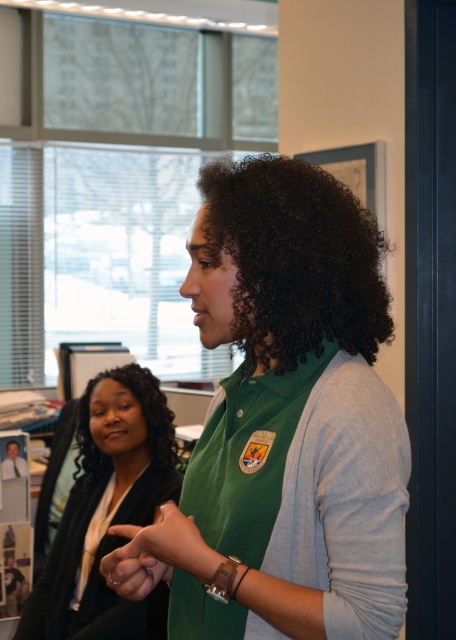
Which is in front, point (123, 387) or point (151, 420)?

Point (151, 420) is in front.

Consider the image. Does matte black jacket at left have a larger size compared to black curly hair at lower left?

Yes, matte black jacket at left is bigger than black curly hair at lower left.

Is point (41, 605) farther from camera compared to point (176, 451)?

No, it is not.

This screenshot has height=640, width=456. I want to click on matte black jacket at left, so click(108, 513).

Consider the image. Can you confirm if green matte vest at center is positioned to the left of smooth skin hand at center?

In fact, green matte vest at center is to the right of smooth skin hand at center.

Between point (361, 346) and point (154, 524), which one is positioned behind?

Positioned behind is point (154, 524).

Locate an element on the screen. green matte vest at center is located at coordinates (293, 413).

Between dark curly hair at center and black curly hair at lower left, which one appears on the left side from the viewer's perspective?

black curly hair at lower left

Does dark curly hair at center appear on the right side of black curly hair at lower left?

Indeed, dark curly hair at center is positioned on the right side of black curly hair at lower left.

Is point (364, 323) positioned in front of point (160, 420)?

Yes, point (364, 323) is in front of point (160, 420).

This screenshot has height=640, width=456. I want to click on dark curly hair at center, so click(x=295, y=260).